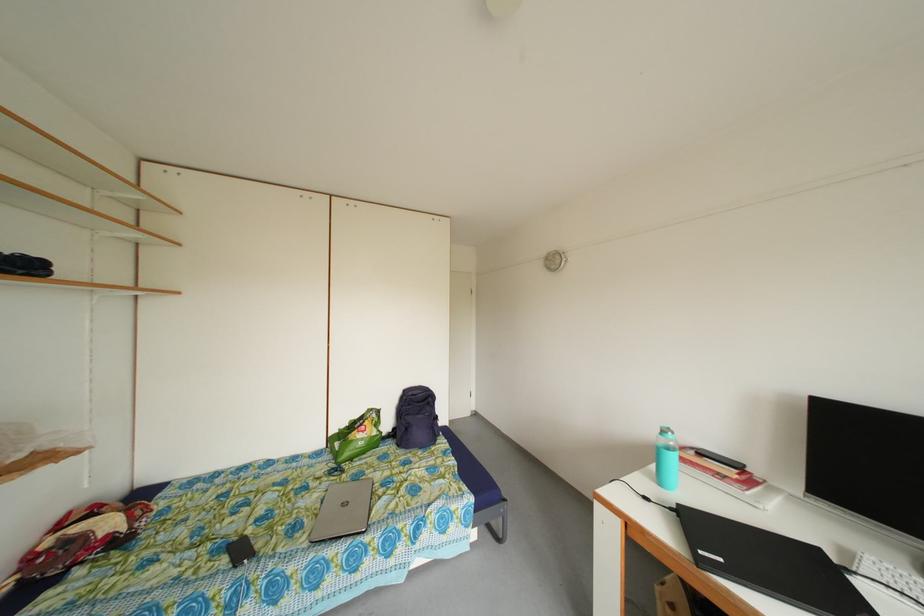
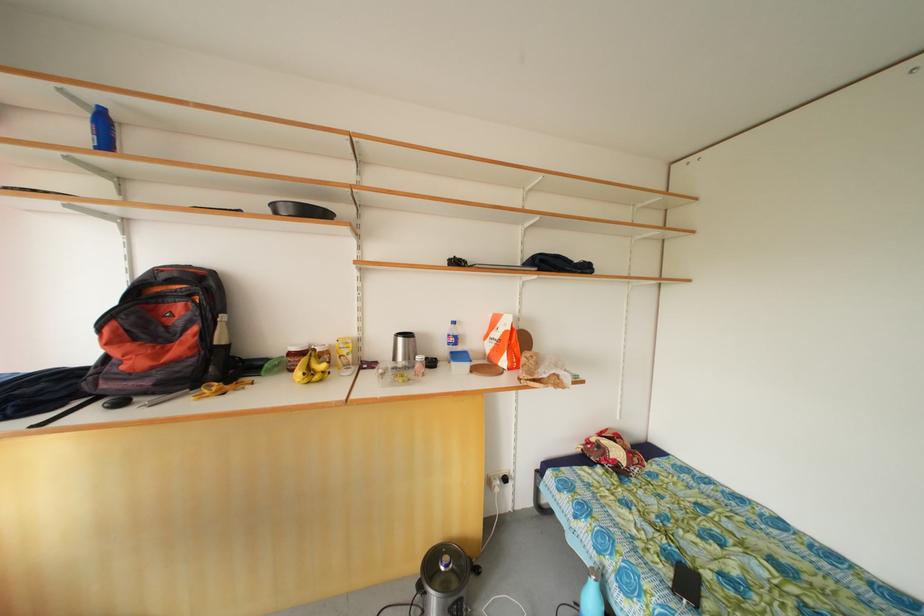
Question: The first image is from the beginning of the video and the second image is from the end. How did the camera likely rotate when shooting the video?

Choices:
 (A) Left
 (B) Right
 (C) Up
 (D) Down

Answer: (A)